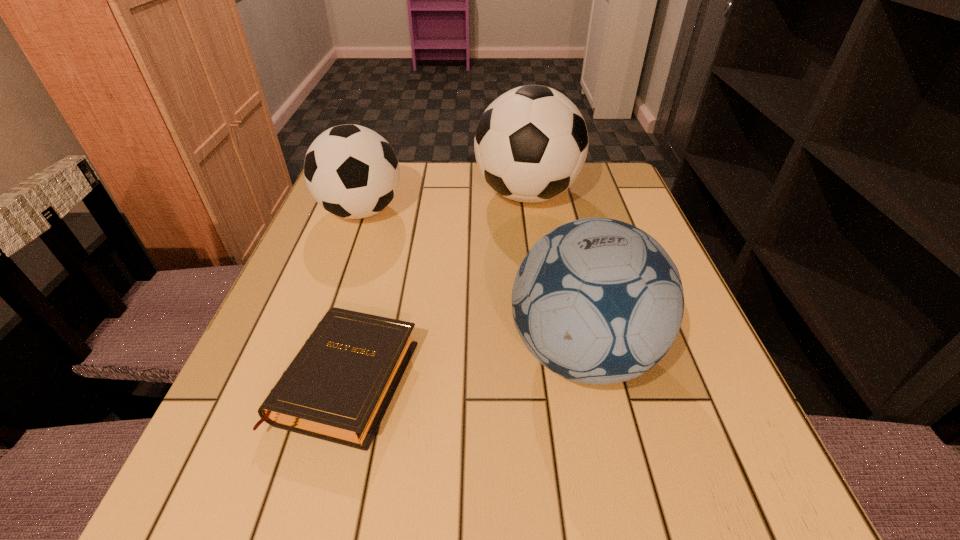
Where is `Bible located in the left edge section of the desktop`? The height and width of the screenshot is (540, 960). Bible located in the left edge section of the desktop is located at coordinates (338, 387).

I want to click on object situated at the far left corner, so click(x=351, y=171).

Locate an element on the screen. object that is at the far right corner is located at coordinates (531, 143).

In the image, there is a desktop. Identify the location of blank space at the left edge. Image resolution: width=960 pixels, height=540 pixels. 351,309.

Image resolution: width=960 pixels, height=540 pixels. I want to click on vacant region at the right edge of the desktop, so click(x=579, y=219).

The image size is (960, 540). I want to click on free spot at the far right corner of the desktop, so click(x=612, y=210).

Identify the location of empty space between the shortest object and the leftmost soccer ball. Image resolution: width=960 pixels, height=540 pixels. (354, 295).

Identify the location of free area in between the leftmost soccer ball and the nearest soccer ball. (471, 282).

Image resolution: width=960 pixels, height=540 pixels. Identify the location of unoccupied position between the third tallest object and the shortest object. (354, 295).

Identify the location of object that is the third closest one to the nearest soccer ball. (351, 171).